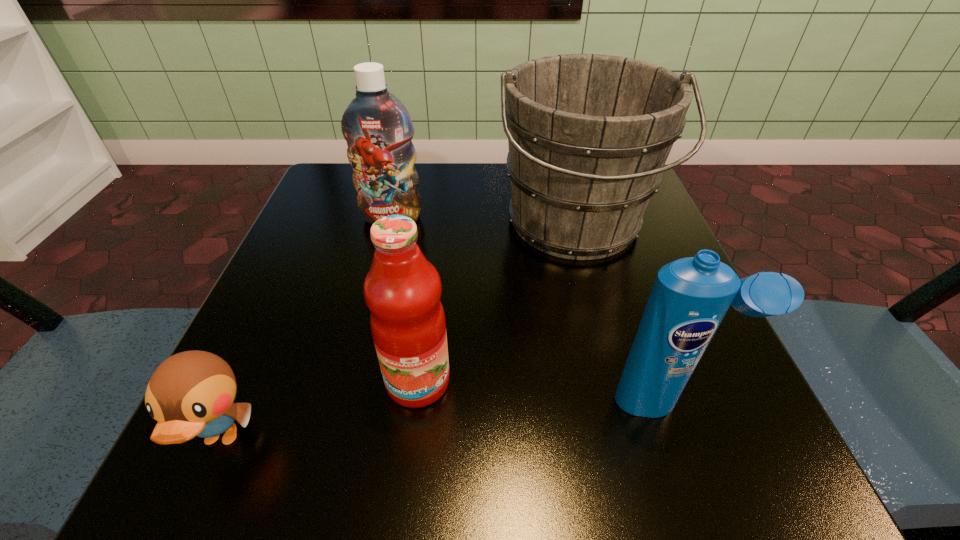
Where is `free space between the duck and the fruit juice`? Image resolution: width=960 pixels, height=540 pixels. free space between the duck and the fruit juice is located at coordinates (320, 410).

In order to click on empty space between the shortest object and the farther shampoo in this screenshot , I will do `click(306, 328)`.

In order to click on free space between the shortest object and the fruit juice in this screenshot , I will do `click(320, 410)`.

I want to click on free spot between the shortest object and the right shampoo, so click(444, 420).

Select which object is the closest to the bucket. Please provide its 2D coordinates. Your answer should be formatted as a tuple, i.e. [(x, y)], where the tuple contains the x and y coordinates of a point satisfying the conditions above.

[(377, 127)]

Identify which object is the nearest to the fruit juice. Please provide its 2D coordinates. Your answer should be formatted as a tuple, i.e. [(x, y)], where the tuple contains the x and y coordinates of a point satisfying the conditions above.

[(191, 393)]

What are the coordinates of `free region that satisfies the following two spatial constraints: 1. on the handle side of the nearer shampoo; 2. on the left side of the bucket` in the screenshot? It's located at (620, 401).

Find the location of a particular element. vacant region that satisfies the following two spatial constraints: 1. on the front label of the farther shampoo; 2. on the right side of the shorter shampoo is located at coordinates (347, 401).

The image size is (960, 540). I want to click on blank area in the image that satisfies the following two spatial constraints: 1. on the front label of the right shampoo; 2. on the left side of the left shampoo, so click(x=347, y=401).

Identify the location of free space that satisfies the following two spatial constraints: 1. on the handle side of the bucket; 2. on the left side of the nearer shampoo. coord(620,401).